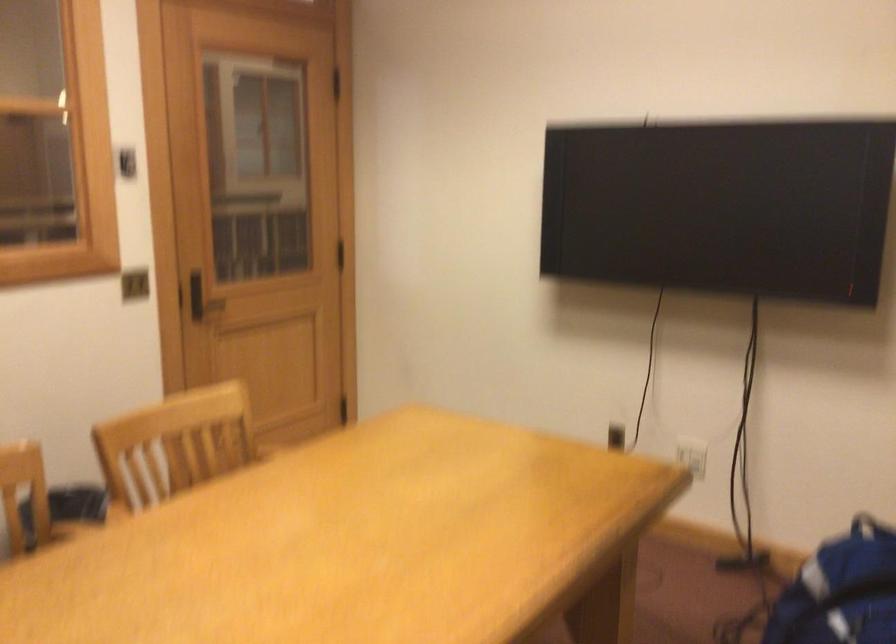
Locate an element on the screen. white power outlet is located at coordinates (692, 455).